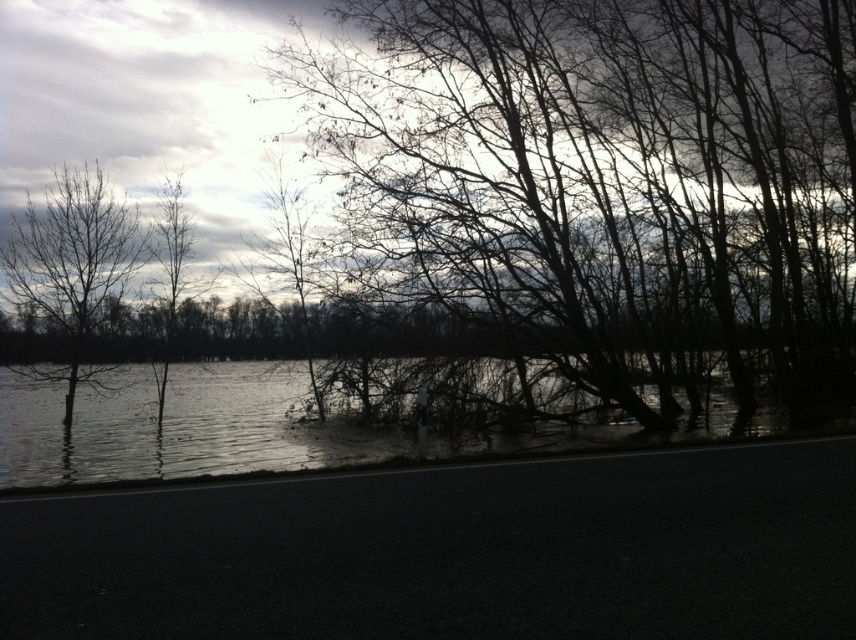
Which of these two, bare branches at left or silvery bark tree at upper left, stands shorter?

silvery bark tree at upper left

Is bare branches at left shorter than silvery bark tree at upper left?

In fact, bare branches at left may be taller than silvery bark tree at upper left.

Is point (74, 196) behind point (163, 400)?

No, it is not.

This screenshot has width=856, height=640. Identify the location of bare branches at left. (72, 268).

Does bare branches at center have a larger size compared to dark reflective water at lower left?

Correct, bare branches at center is larger in size than dark reflective water at lower left.

This screenshot has height=640, width=856. What do you see at coordinates (599, 180) in the screenshot? I see `bare branches at center` at bounding box center [599, 180].

Between point (761, 196) and point (43, 451), which one is positioned behind?

The point (761, 196) is more distant.

This screenshot has width=856, height=640. I want to click on bare branches at center, so [599, 180].

Does point (453, 42) come in front of point (10, 282)?

Yes.

Identify the location of bare branches at center. (599, 180).